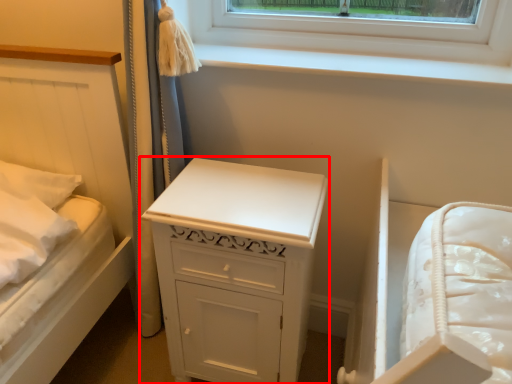
Question: Observing the image, what is the correct spatial positioning of chest of drawers (annotated by the red box) in reference to window sill?

Choices:
 (A) left
 (B) right

Answer: (A)